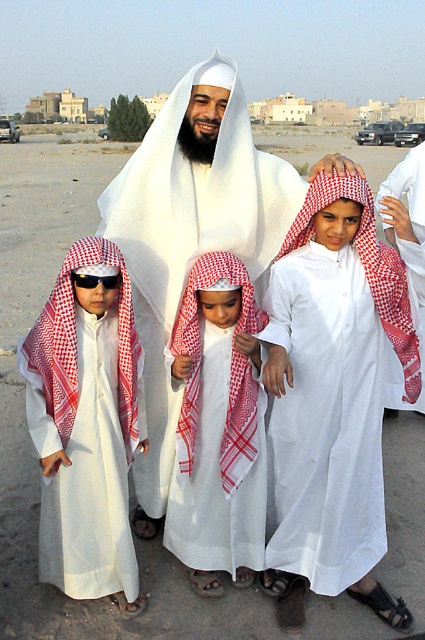
Question: Estimate the real-world distances between objects in this image. Which object is farther from the white checkered headscarf at center?

Choices:
 (A) white matte robe at center
 (B) white matte robe at left

Answer: (B)

Question: Which is farther from the white matte robe at center?

Choices:
 (A) white cotton robe at center
 (B) white matte/soft cloth at center

Answer: (B)

Question: Is white checkered headscarf at center thinner than black plastic sunglasses at center?

Choices:
 (A) no
 (B) yes

Answer: (A)

Question: Observing the image, what is the correct spatial positioning of white matte/soft cloth at center in reference to white checkered headscarf at center?

Choices:
 (A) right
 (B) left

Answer: (B)

Question: Which point is farther to the camera?

Choices:
 (A) (104, 268)
 (B) (198, 522)
 (C) (158, 138)

Answer: (C)

Question: Is white matte/soft cloth at center behind white matte robe at left?

Choices:
 (A) yes
 (B) no

Answer: (A)